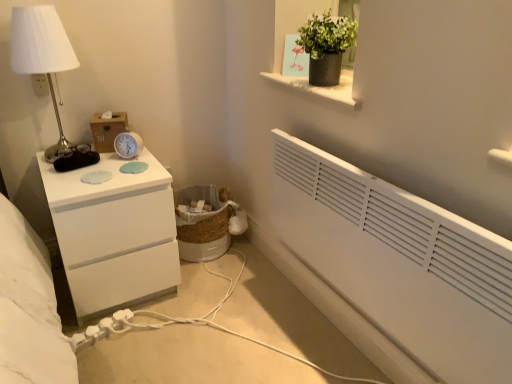
Question: Is white metallic table lamp at left inside white plastic electric outlet at upper left?

Choices:
 (A) yes
 (B) no

Answer: (B)

Question: Is white plastic electric outlet at upper left positioned beyond the bounds of white metallic table lamp at left?

Choices:
 (A) no
 (B) yes

Answer: (B)

Question: Are white plastic electric outlet at upper left and white metallic table lamp at left far apart?

Choices:
 (A) no
 (B) yes

Answer: (A)

Question: Is white plastic electric outlet at upper left positioned with its back to white metallic table lamp at left?

Choices:
 (A) no
 (B) yes

Answer: (A)

Question: From the image's perspective, is white plastic electric outlet at upper left under white metallic table lamp at left?

Choices:
 (A) yes
 (B) no

Answer: (B)

Question: Does white plastic electric outlet at upper left touch white metallic table lamp at left?

Choices:
 (A) no
 (B) yes

Answer: (A)

Question: Could you tell me if white glossy chest of drawers at left is turned towards white plastic alarm clock at upper left?

Choices:
 (A) no
 (B) yes

Answer: (A)

Question: From a real-world perspective, is white glossy chest of drawers at left positioned over white plastic alarm clock at upper left based on gravity?

Choices:
 (A) yes
 (B) no

Answer: (B)

Question: Is white glossy chest of drawers at left not within white plastic alarm clock at upper left?

Choices:
 (A) no
 (B) yes

Answer: (B)

Question: Is white glossy chest of drawers at left further to the viewer compared to white plastic alarm clock at upper left?

Choices:
 (A) no
 (B) yes

Answer: (A)

Question: Is white plastic alarm clock at upper left a part of white glossy chest of drawers at left?

Choices:
 (A) no
 (B) yes

Answer: (A)

Question: Would you say white glossy chest of drawers at left is a long distance from white plastic alarm clock at upper left?

Choices:
 (A) yes
 (B) no

Answer: (B)

Question: Considering the relative sizes of woven natural laundry basket at lower center and white plastic alarm clock at upper left in the image provided, is woven natural laundry basket at lower center wider than white plastic alarm clock at upper left?

Choices:
 (A) yes
 (B) no

Answer: (A)